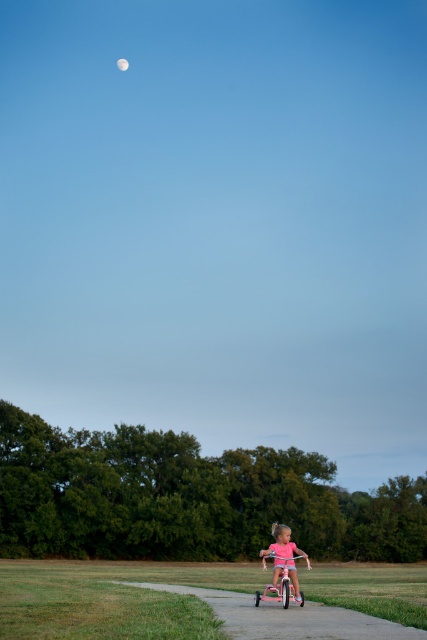
You are standing on the paved pathway in the scene and want to walk towards the moon in the sky. Which point, point (234, 612) or point (278, 561), is closer to you as you start walking?

Point (234, 612) is closer to the viewer than point (278, 561).

You are standing at the point with coordinates [283,557]. Looking around, you see the pink matte tricycle at center. What object is located at your current position?

The pink matte tricycle at center is located at the point with coordinates [283,557].

You are a photographer trying to capture the pink rubber pavement at lower center and the silvery reflective moon at upper center in the same frame. Which object should you focus on first to ensure both are in the frame?

The pink rubber pavement at lower center is bigger than the silvery reflective moon at upper center, so you should focus on the pink rubber pavement at lower center first to ensure both are in the frame.